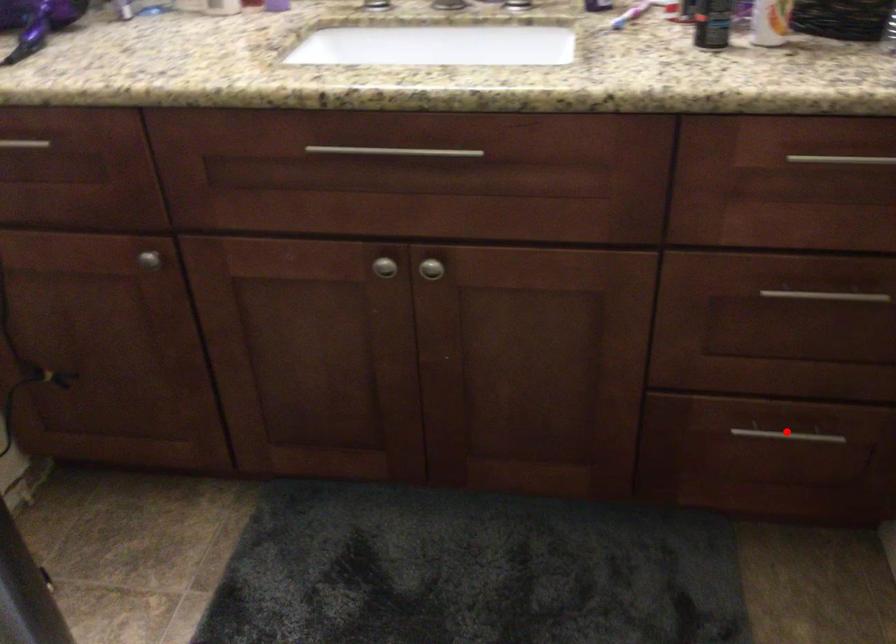
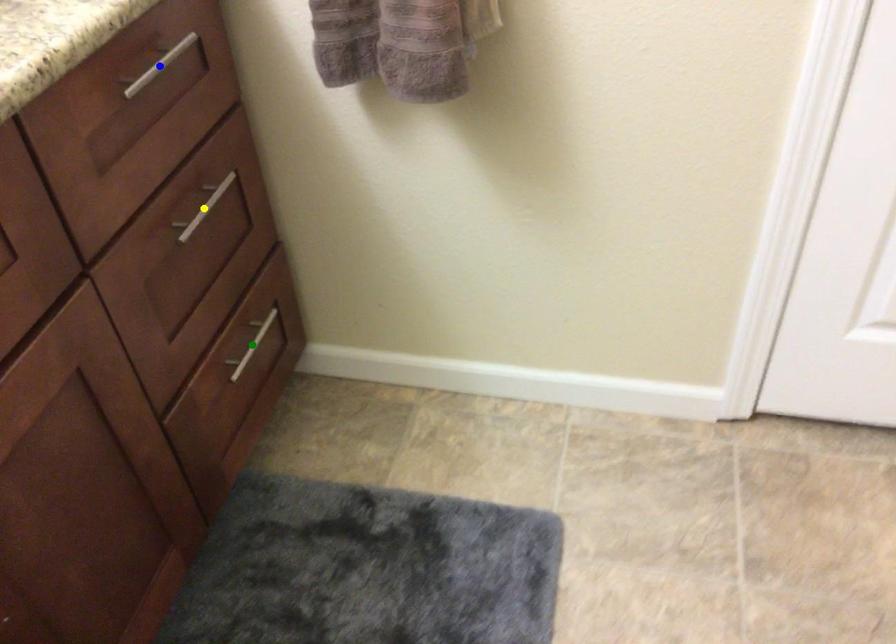
Question: I am providing you with two images of the same scene from different viewpoints. A red point is marked on the first image. You are given multiple points on the second image. Which point in image 2 represents the same 3d spot as the red point in image 1?

Choices:
 (A) yellow point
 (B) blue point
 (C) green point

Answer: (C)